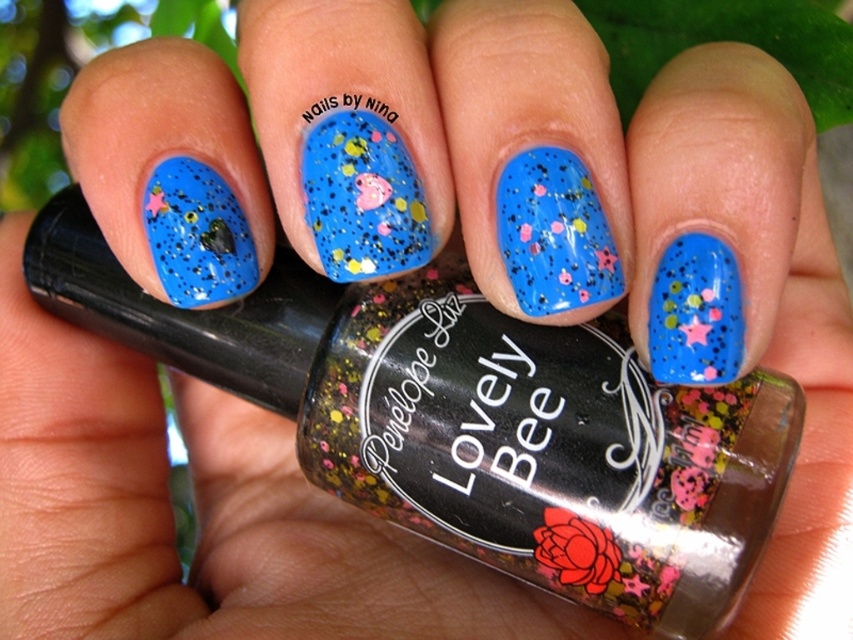
You are a nail technician and need to apply a new design to the glittery blue nail art with colorful speckles at center. Where exactly should you place the new design to avoid covering the existing speckles?

The glittery blue nail art with colorful speckles at center is located at point (363, 196), so you should place the new design away from that coordinate to avoid covering the existing speckles.

You are a nail technician observing a client whose nails have the glittery blue nail art with colorful speckles at center and the glittery blue nail at center. The client wants to add a rhinestone decoration. Which nail should you place the rhinestone on to ensure it doesn not cover the colorful speckles?

The glittery blue nail art with colorful speckles at center is taller than the glittery blue nail at center, so placing the rhinestone on the glittery blue nail art with colorful speckles at center will ensure it doesn not cover the colorful speckles.

You are a nail technician observing a client with the glittery blue nail art with colorful speckles at center and the glittery blue nail at center. Which nail is positioned higher on the hand?

The glittery blue nail art with colorful speckles at center is above the glittery blue nail at center, so it is positioned higher on the hand.